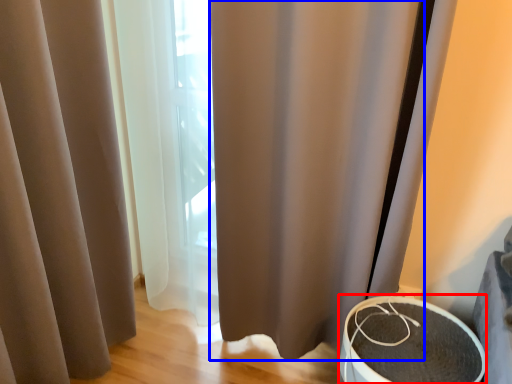
Question: Which object is closer to the camera taking this photo, round table (highlighted by a red box) or shower curtain (highlighted by a blue box)?

Choices:
 (A) round table
 (B) shower curtain

Answer: (B)